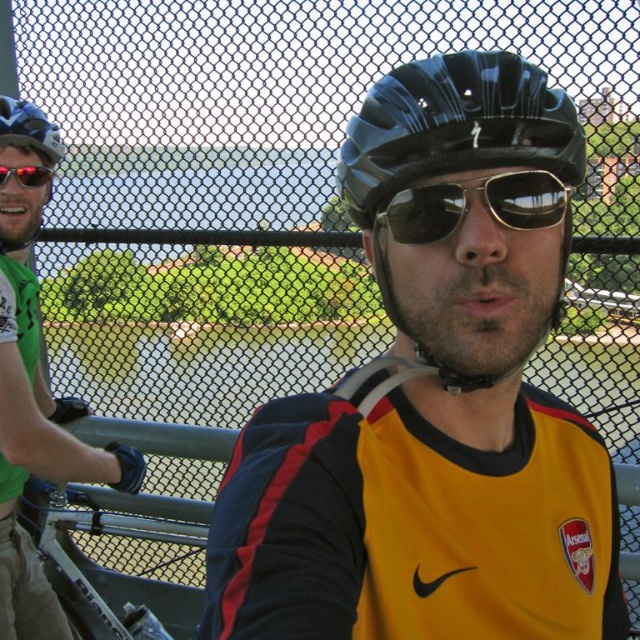
Question: Considering the relative positions of green matte helmet at left and matte black helmet at left in the image provided, where is green matte helmet at left located with respect to matte black helmet at left?

Choices:
 (A) left
 (B) right

Answer: (A)

Question: Which object appears farthest from the camera in this image?

Choices:
 (A) metallic gray rail at center
 (B) sunglasses at center
 (C) shiny reflective sunglasses at upper left
 (D) matte black helmet at upper left

Answer: (A)

Question: Does green matte helmet at left have a smaller size compared to shiny reflective sunglasses at upper left?

Choices:
 (A) yes
 (B) no

Answer: (B)

Question: Which is nearer to the matte black helmet at left?

Choices:
 (A) metallic gray rail at center
 (B) matte black helmet at center
 (C) shiny reflective sunglasses at upper left

Answer: (C)

Question: Does matte black helmet at center appear on the right side of metallic gray rail at center?

Choices:
 (A) yes
 (B) no

Answer: (A)

Question: Which of these objects is positioned closest to the matte black helmet at left?

Choices:
 (A) green matte helmet at left
 (B) matte black helmet at upper left
 (C) glossy black helmet at center
 (D) matte black helmet at center

Answer: (B)